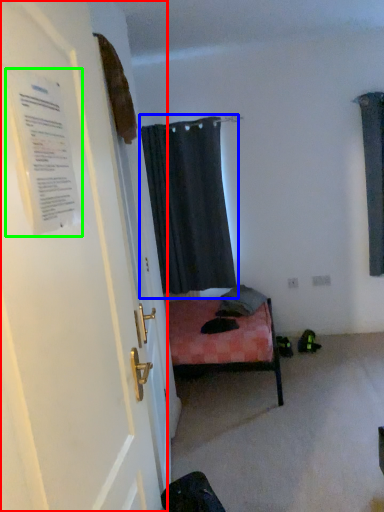
Question: Based on their relative distances, which object is nearer to door (highlighted by a red box)? Choose from curtain (highlighted by a blue box) and poster (highlighted by a green box).

Choices:
 (A) curtain
 (B) poster

Answer: (B)